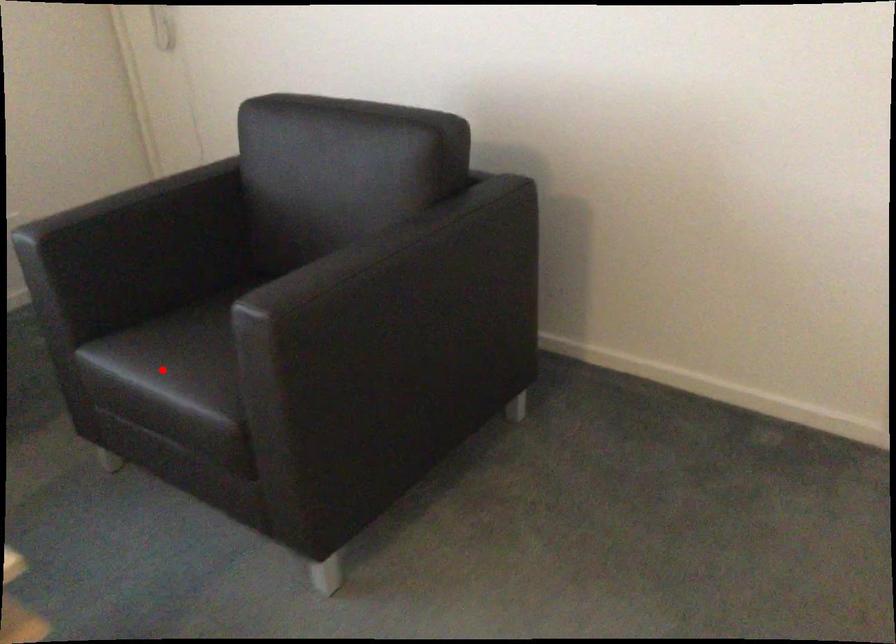
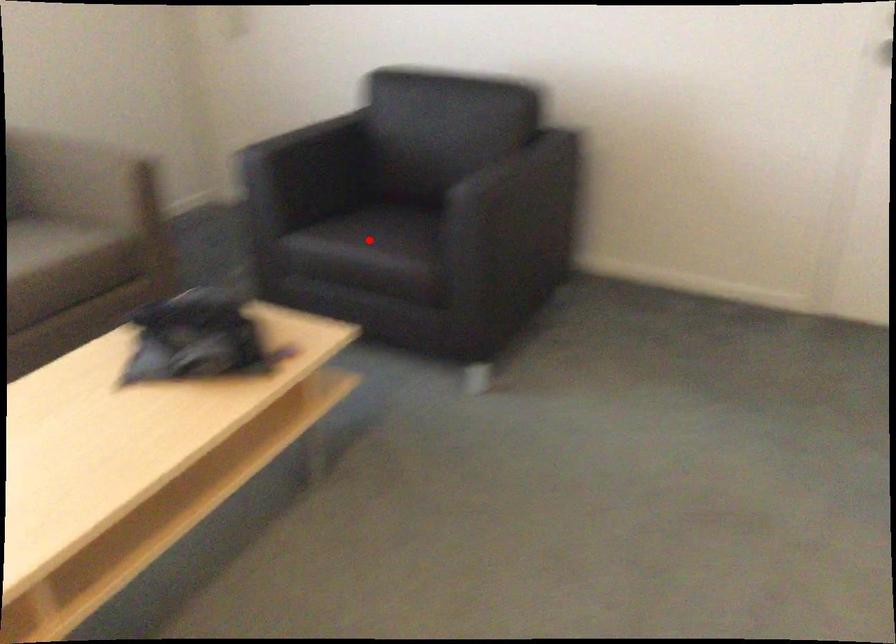
I am providing you with two images of the same scene from different viewpoints. A red point is marked on the first image and another point is marked on the second image. Does the point marked in image1 correspond to the same location as the one in image2?

Yes